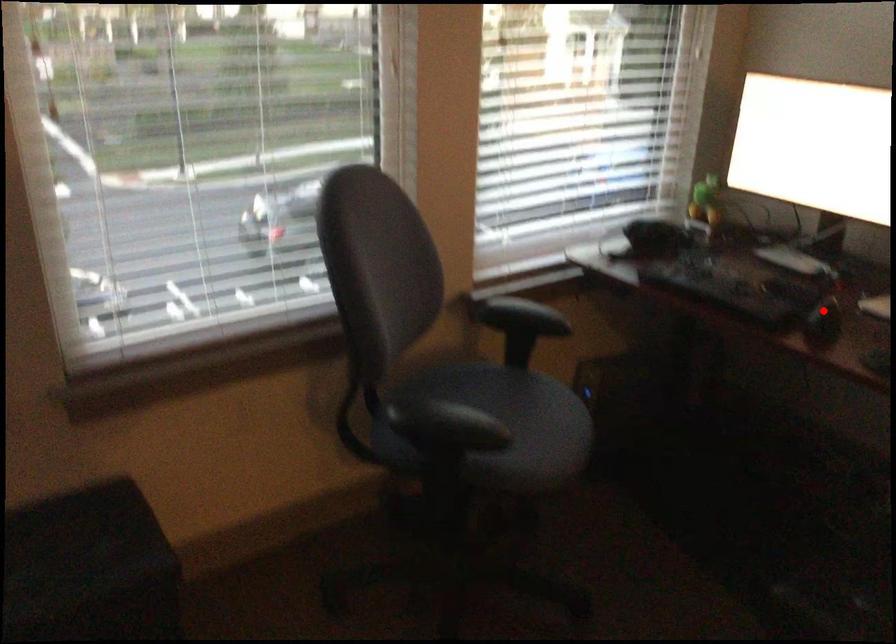
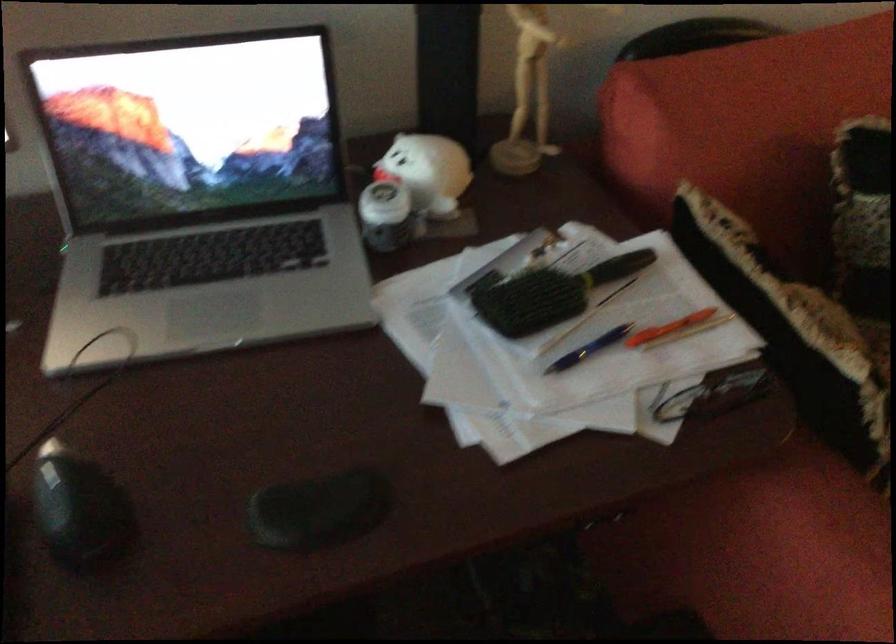
Question: I am providing you with two images of the same scene from different viewpoints. Image1 has a red point marked. In image2, the corresponding 3D location appears at what relative position? Reply with the corresponding letter.

Choices:
 (A) Closer
 (B) Farther

Answer: (A)